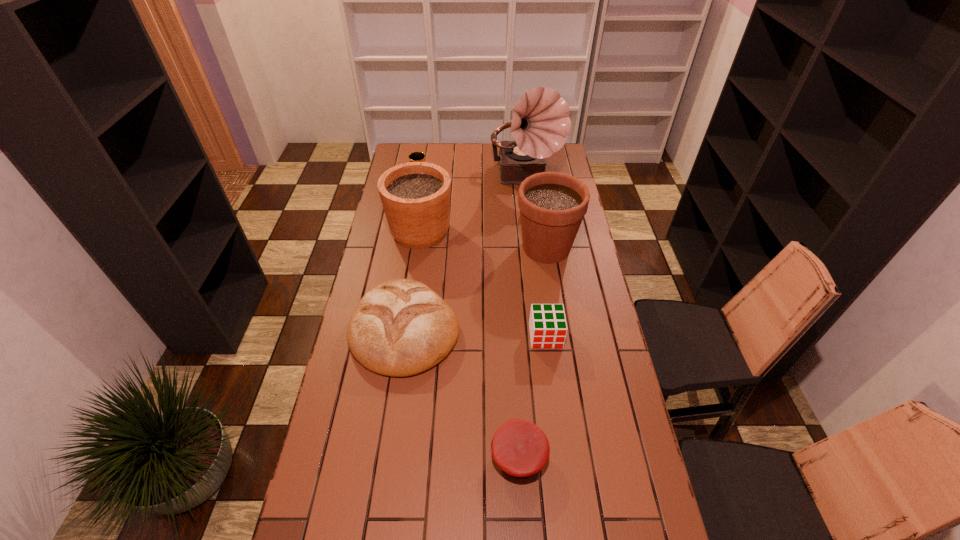
Where is `bread present at the left edge`? bread present at the left edge is located at coordinates (401, 327).

What are the coordinates of `record player that is at the right edge` in the screenshot? It's located at (540, 123).

You are a GUI agent. You are given a task and a screenshot of the screen. Output one action in this format:
    pyautogui.click(x=<x>, y=<y>)
    Task: Click on the flowerpot that is at the right edge
    
    Given the screenshot: What is the action you would take?
    [552, 205]

This screenshot has width=960, height=540. In order to click on object positioned at the far right corner in this screenshot , I will do `click(540, 123)`.

In the image, there is a desktop. What are the coordinates of `free space at the left edge` in the screenshot? It's located at (352, 364).

Locate an element on the screen. The width and height of the screenshot is (960, 540). vacant region at the right edge is located at coordinates (612, 485).

The width and height of the screenshot is (960, 540). I want to click on free space between the right flowerpot and the left flowerpot, so click(484, 240).

Where is `vacant space in between the chalice and the record player`? The height and width of the screenshot is (540, 960). vacant space in between the chalice and the record player is located at coordinates (472, 179).

Locate an element on the screen. The image size is (960, 540). empty space that is in between the right flowerpot and the cube is located at coordinates (546, 292).

This screenshot has height=540, width=960. I want to click on free spot between the bread and the cube, so click(475, 333).